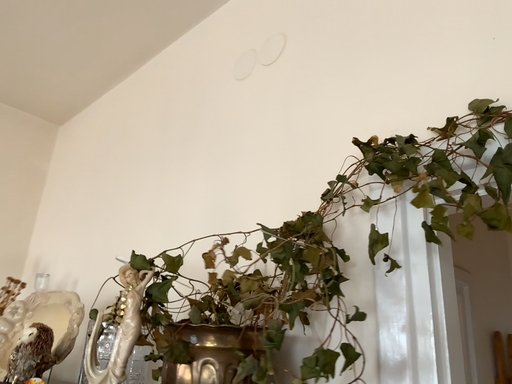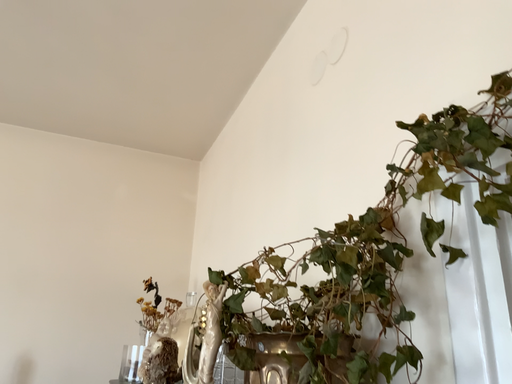
Question: How did the camera likely rotate when shooting the video?

Choices:
 (A) rotated right
 (B) rotated left

Answer: (B)